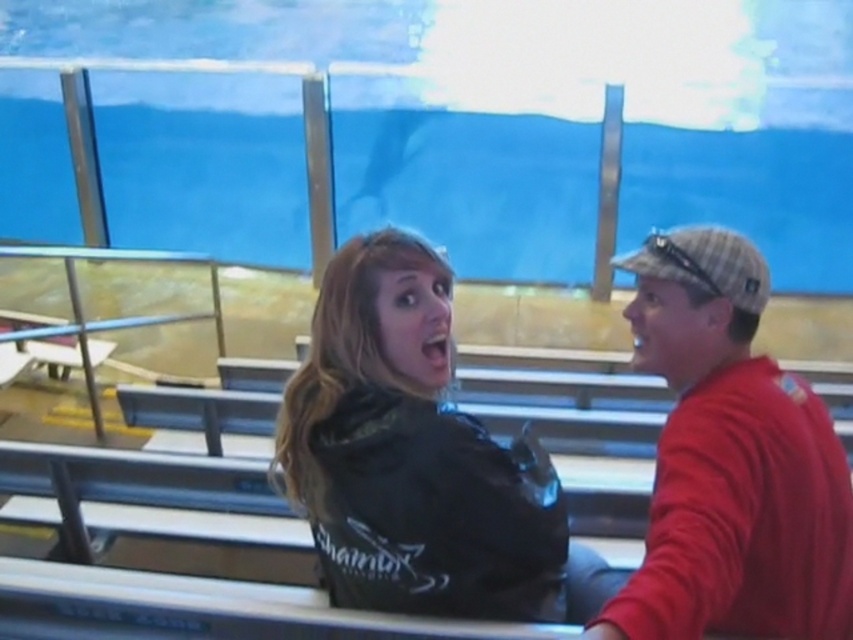
Question: Can you confirm if red cotton shirt at right is positioned below black matte jacket at center?

Choices:
 (A) yes
 (B) no

Answer: (A)

Question: Can you confirm if red cotton shirt at right is smaller than black matte jacket at center?

Choices:
 (A) yes
 (B) no

Answer: (B)

Question: Does red cotton shirt at right lie in front of black matte jacket at center?

Choices:
 (A) no
 (B) yes

Answer: (B)

Question: Which point is farther from the camera taking this photo?

Choices:
 (A) click(x=521, y=504)
 (B) click(x=836, y=534)

Answer: (B)

Question: Which point appears farthest from the camera in this image?

Choices:
 (A) (418, 515)
 (B) (703, 502)

Answer: (A)